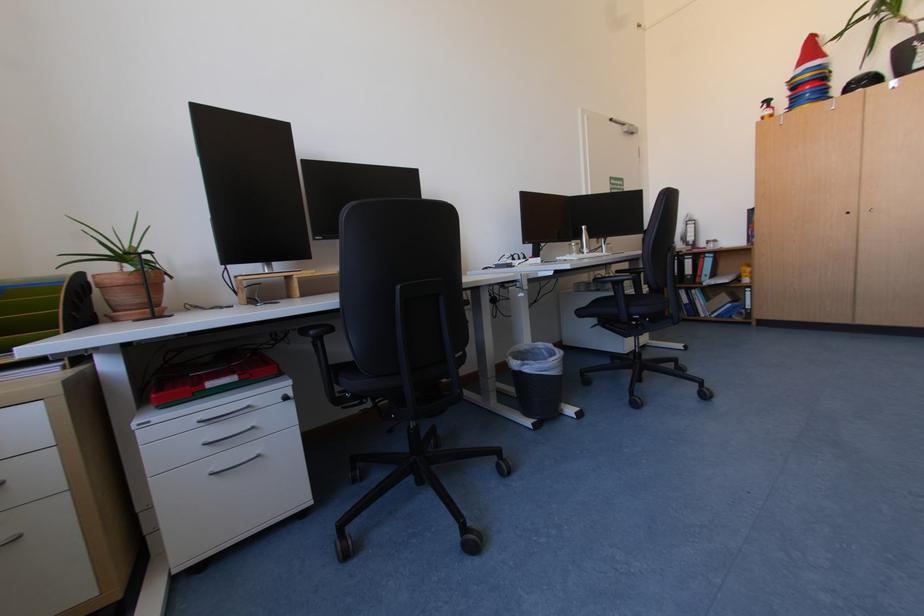
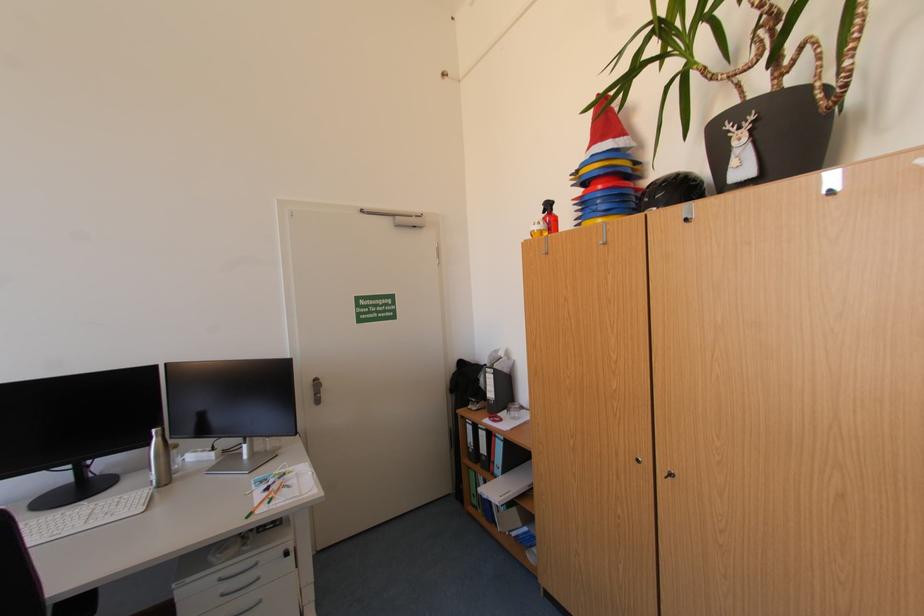
In the second image, find the point that corresponds to pixel 816 95 in the first image.

(606, 203)